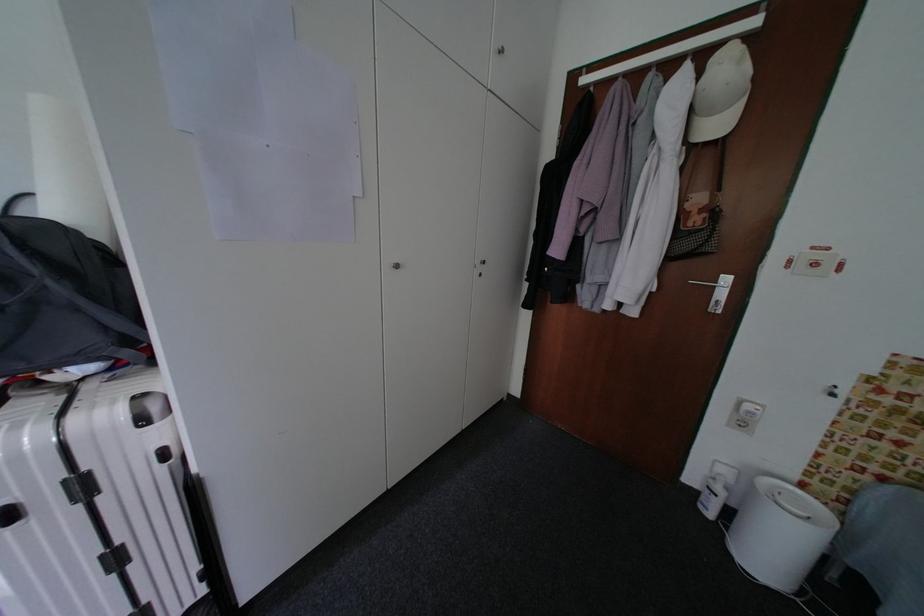
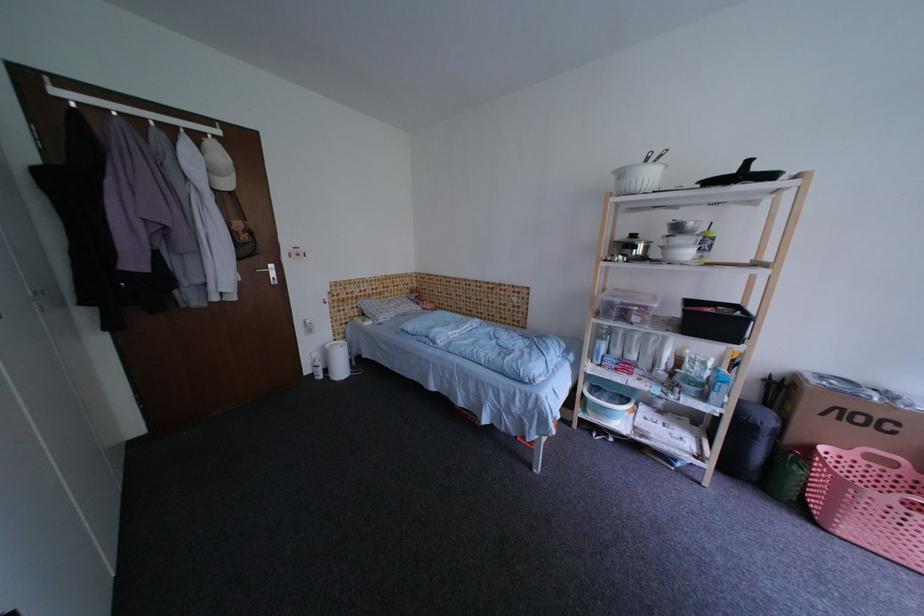
Find the pixel in the second image that matches the point at 698,482 in the first image.

(314, 374)